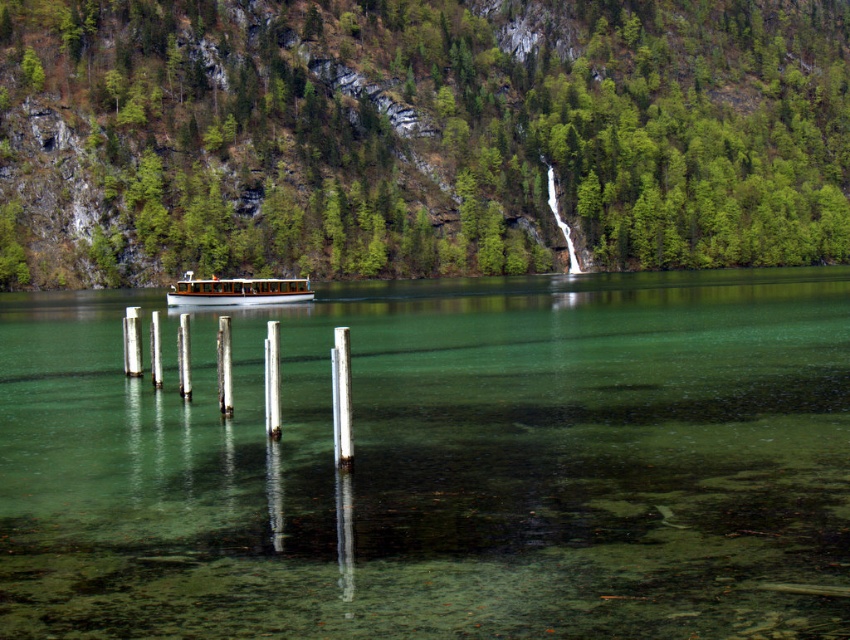
You are standing on the dock and see the white polished wood boat at center floating on the clear water at center. Can you safely step onto the boat without getting your feet wet?

The clear water at center is below the white polished wood boat at center, so stepping onto the boat would not get your feet wet as the water is beneath the boat.

You are standing at the edge of the water and want to reach the point marked as point (241, 300). There is an obstacle at point (516, 474). Which point should you avoid stepping on to reach your destination safely?

You should avoid stepping on point (516, 474) because it is closer to the camera and might be an obstacle blocking your path to point (241, 300).